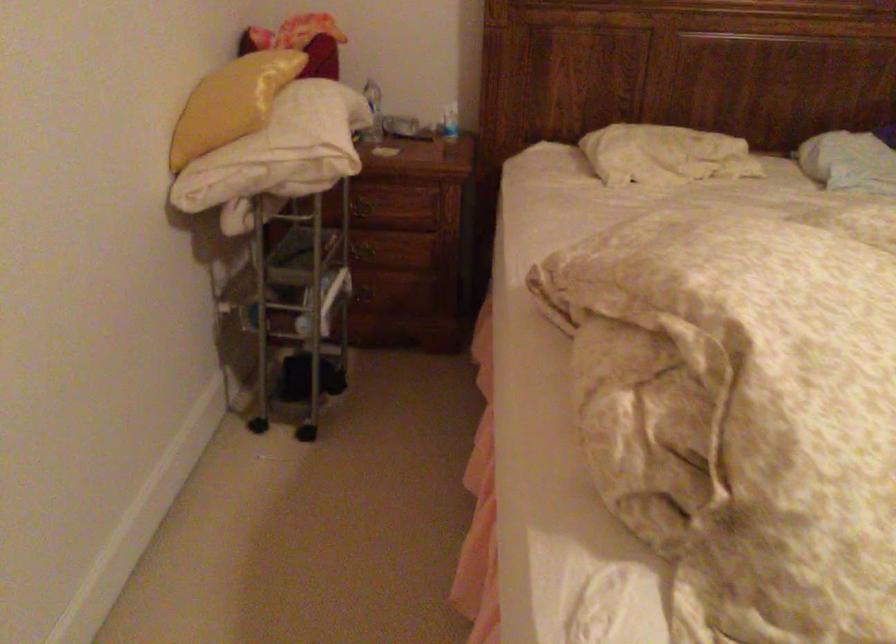
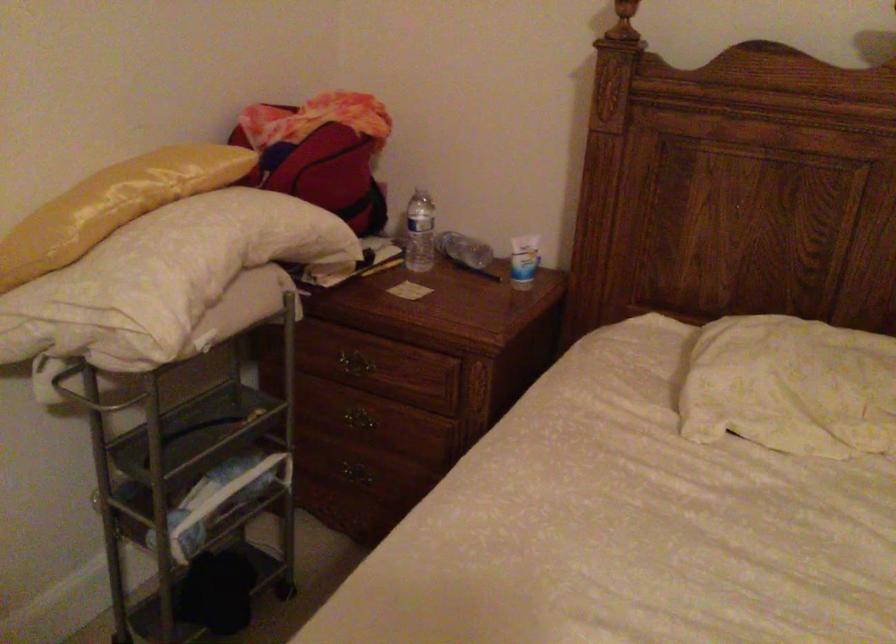
The point at (366, 296) is marked in the first image. Where is the corresponding point in the second image?

(355, 473)